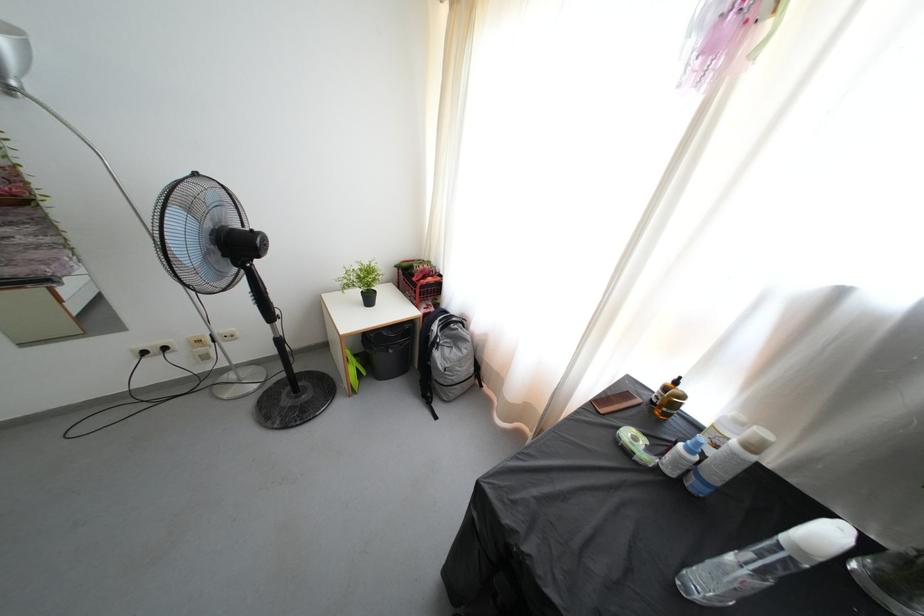
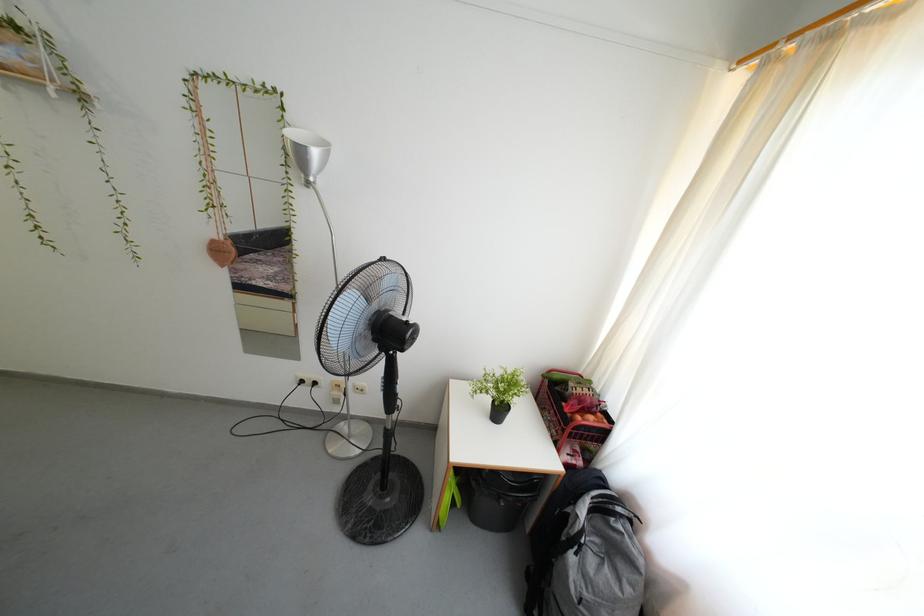
Question: The camera is either moving clockwise (left) or counter-clockwise (right) around the object. The first image is from the beginning of the video and the second image is from the end. Is the camera moving left or right when shooting the video?

Choices:
 (A) Left
 (B) Right

Answer: (B)